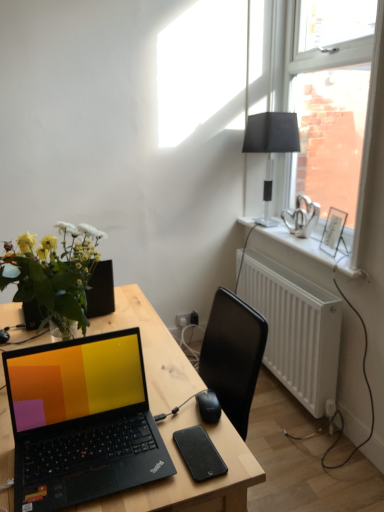
Locate an element on the screen. free space to the back side of black matte tablet at center is located at coordinates [181, 408].